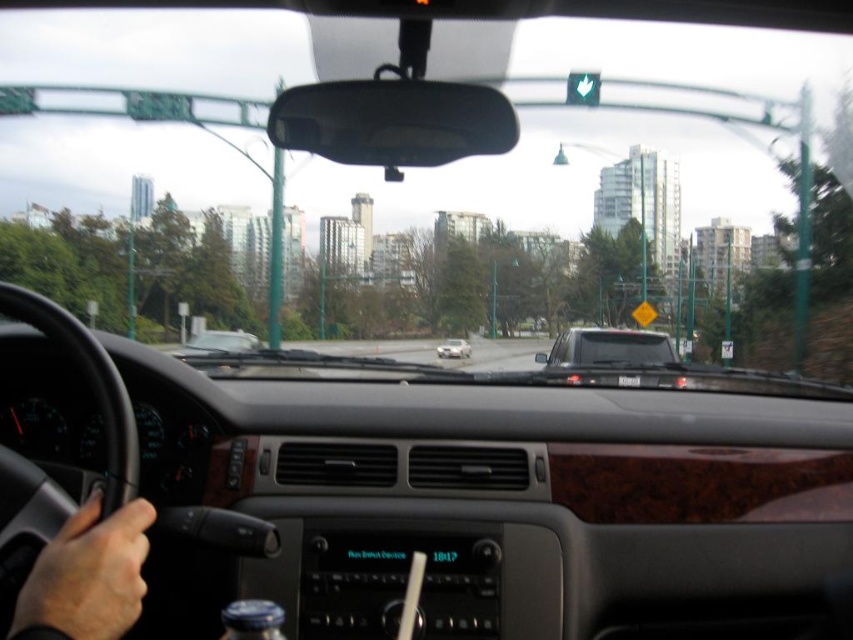
Question: Is green matte traffic light at upper center positioned before satin silver sedan at center?

Choices:
 (A) yes
 (B) no

Answer: (A)

Question: Which point is closer to the camera taking this photo?

Choices:
 (A) (595, 81)
 (B) (126, 554)

Answer: (B)

Question: Among these objects, which one is nearest to the camera?

Choices:
 (A) green matte traffic light at upper center
 (B) satin silver sedan at center
 (C) matte black car at center

Answer: (C)

Question: Is smooth skin hand at lower left smaller than satin silver sedan at center?

Choices:
 (A) no
 (B) yes

Answer: (B)

Question: Can you confirm if smooth skin hand at lower left is positioned above satin silver sedan at center?

Choices:
 (A) yes
 (B) no

Answer: (A)

Question: Which point is farther to the camera?

Choices:
 (A) (117, 625)
 (B) (599, 364)
 (C) (460, 348)
 (D) (576, 83)

Answer: (C)